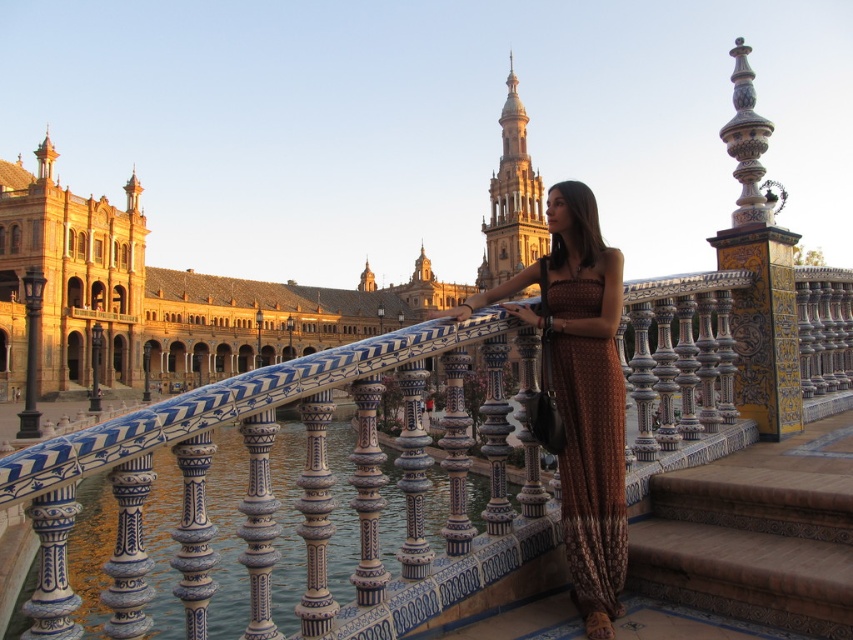
Who is positioned more to the right, blue and white ceramic rail at center or brown textured dress at center?

Positioned to the right is brown textured dress at center.

From the picture: Who is more forward, (260, 371) or (624, 468)?

Point (260, 371) is more forward.

The height and width of the screenshot is (640, 853). I want to click on blue and white ceramic rail at center, so click(297, 499).

Is brown woven dress at center wider than brown textured dress at center?

Yes, brown woven dress at center is wider than brown textured dress at center.

Which is more to the right, brown woven dress at center or brown textured dress at center?

brown textured dress at center is more to the right.

I want to click on brown woven dress at center, so click(x=581, y=392).

Where is `brown woven dress at center`? The height and width of the screenshot is (640, 853). brown woven dress at center is located at coordinates (581, 392).

Which of these two, blue and white ceramic rail at center or brown woven dress at center, stands taller?

blue and white ceramic rail at center is taller.

Is blue and white ceramic rail at center taller than brown woven dress at center?

Yes.

At what (x,y) coordinates should I click in order to perform the action: click on blue and white ceramic rail at center. Please return your answer as a coordinate pair (x, y). The width and height of the screenshot is (853, 640). Looking at the image, I should click on (297, 499).

Find the location of `blue and white ceramic rail at center`. blue and white ceramic rail at center is located at coordinates (297, 499).